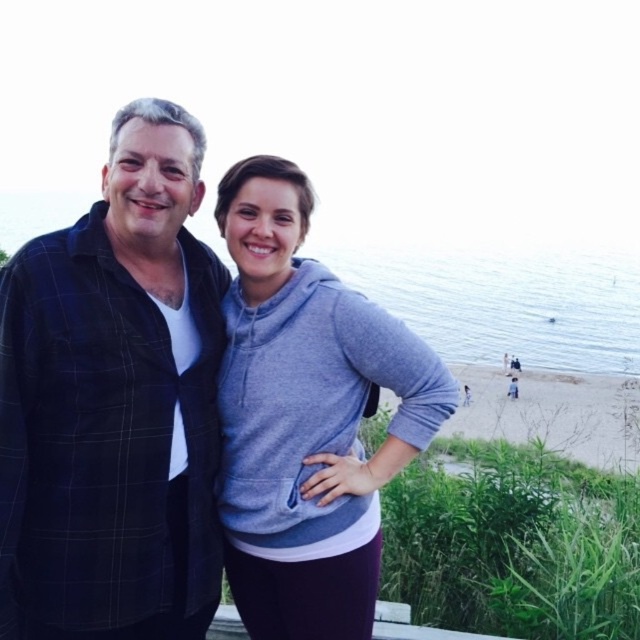
Can you confirm if dark blue plaid shirt at left is positioned to the left of gray fleece hoodie at center?

Correct, you'll find dark blue plaid shirt at left to the left of gray fleece hoodie at center.

Identify the location of dark blue plaid shirt at left. Image resolution: width=640 pixels, height=640 pixels. (113, 403).